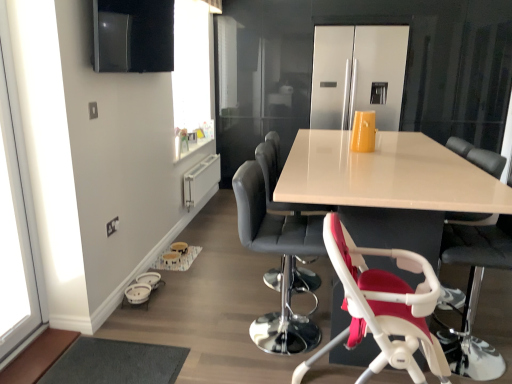
Question: From the image's perspective, is stainless steel refrigerator at center above transparent glass window at left?

Choices:
 (A) no
 (B) yes

Answer: (B)

Question: Does stainless steel refrigerator at center have a lesser width compared to transparent glass window at left?

Choices:
 (A) no
 (B) yes

Answer: (A)

Question: Can you confirm if stainless steel refrigerator at center is wider than transparent glass window at left?

Choices:
 (A) no
 (B) yes

Answer: (B)

Question: Is the depth of stainless steel refrigerator at center greater than that of transparent glass window at left?

Choices:
 (A) no
 (B) yes

Answer: (B)

Question: Can transparent glass window at left be found inside stainless steel refrigerator at center?

Choices:
 (A) no
 (B) yes

Answer: (A)

Question: Is transparent glass window at left at the back of stainless steel refrigerator at center?

Choices:
 (A) no
 (B) yes

Answer: (A)

Question: Considering the relative sizes of black leather bar stool at center, which is the 3th chair from front to back, and white glossy table at center in the image provided, is black leather bar stool at center, which is the 3th chair from front to back, smaller than white glossy table at center?

Choices:
 (A) yes
 (B) no

Answer: (A)

Question: Is black leather bar stool at center, marked as the 2th chair in a back-to-front arrangement, next to white glossy table at center?

Choices:
 (A) no
 (B) yes

Answer: (A)

Question: Is black leather bar stool at center, which is the 3th chair from front to back, wider than white glossy table at center?

Choices:
 (A) no
 (B) yes

Answer: (A)

Question: From the image's perspective, would you say black leather bar stool at center, which is the 3th chair from front to back, is positioned over white glossy table at center?

Choices:
 (A) no
 (B) yes

Answer: (A)

Question: From a real-world perspective, is black leather bar stool at center, marked as the 2th chair in a back-to-front arrangement, on top of white glossy table at center?

Choices:
 (A) no
 (B) yes

Answer: (B)

Question: Is black leather bar stool at center, marked as the 2th chair in a back-to-front arrangement, to the left of white glossy table at center from the viewer's perspective?

Choices:
 (A) no
 (B) yes

Answer: (B)

Question: From a real-world perspective, is stainless steel refrigerator at center positioned under white plastic baby carriage at lower left based on gravity?

Choices:
 (A) yes
 (B) no

Answer: (B)